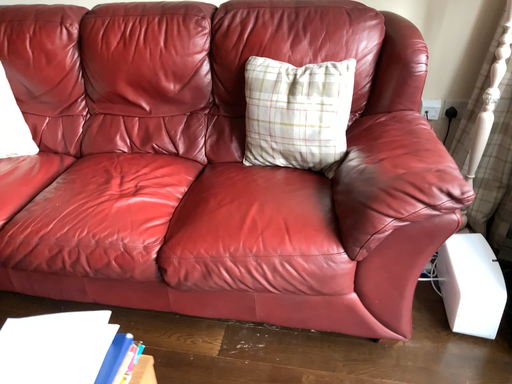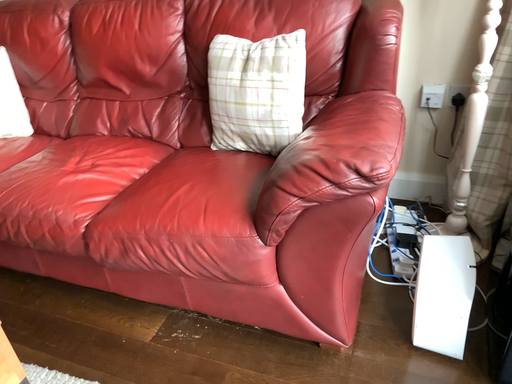
Question: How did the camera likely rotate when shooting the video?

Choices:
 (A) rotated left
 (B) rotated right

Answer: (A)